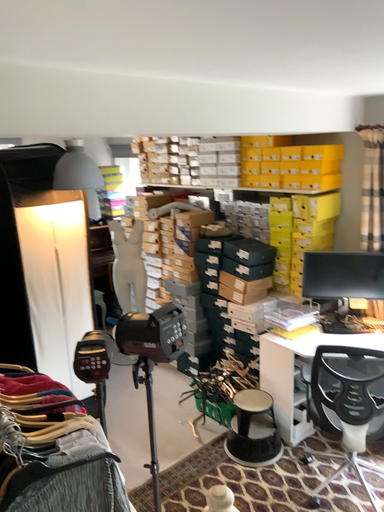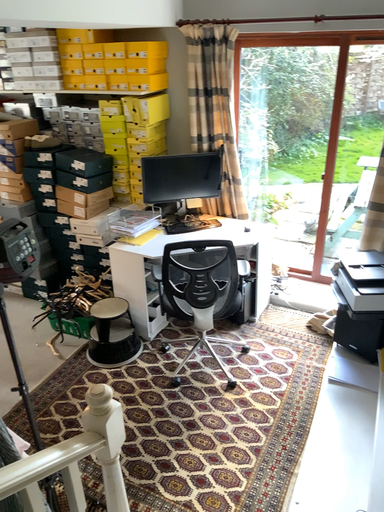
Question: How did the camera likely rotate when shooting the video?

Choices:
 (A) rotated right
 (B) rotated left

Answer: (A)